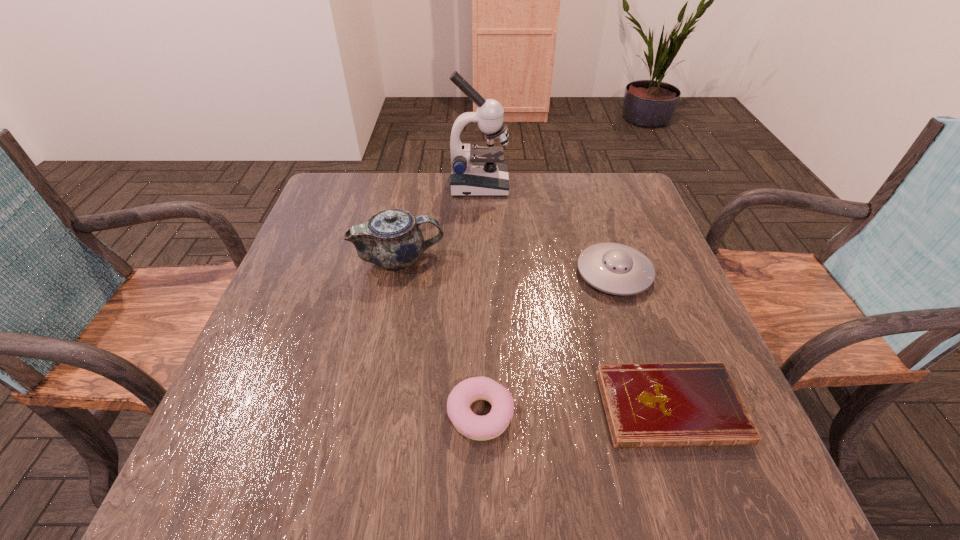
Image resolution: width=960 pixels, height=540 pixels. What are the coordinates of `free spot between the third tallest object and the chinaware` in the screenshot? It's located at (507, 266).

I want to click on free space between the third shortest object and the doughnut, so click(547, 344).

You are a GUI agent. You are given a task and a screenshot of the screen. Output one action in this format:
    pyautogui.click(x=<x>, y=<y>)
    Task: Click on the vacant area that lies between the chinaware and the third shortest object
    
    Given the screenshot: What is the action you would take?
    pyautogui.click(x=507, y=266)

Identify which object is located as the third nearest to the second tallest object. Please provide its 2D coordinates. Your answer should be formatted as a tuple, i.e. [(x, y)], where the tuple contains the x and y coordinates of a point satisfying the conditions above.

[(614, 268)]

Select which object appears as the third closest to the fourth tallest object. Please provide its 2D coordinates. Your answer should be formatted as a tuple, i.e. [(x, y)], where the tuple contains the x and y coordinates of a point satisfying the conditions above.

[(391, 239)]

The image size is (960, 540). I want to click on free space that satisfies the following two spatial constraints: 1. at the eyepiece of the notebook; 2. on the left side of the tallest object, so click(478, 407).

Image resolution: width=960 pixels, height=540 pixels. I want to click on free space that satisfies the following two spatial constraints: 1. from the spout of the notebook; 2. on the left side of the second tallest object, so pos(371,407).

Identify the location of vacant region that satisfies the following two spatial constraints: 1. at the eyepiece of the microscope; 2. on the right side of the fourth tallest object. The width and height of the screenshot is (960, 540). (478, 414).

At what (x,y) coordinates should I click in order to perform the action: click on vacant position in the image that satisfies the following two spatial constraints: 1. on the back side of the saucer; 2. from the spout of the chinaware. Please return your answer as a coordinate pair (x, y). Image resolution: width=960 pixels, height=540 pixels. Looking at the image, I should click on (610, 259).

Find the location of a particular element. The height and width of the screenshot is (540, 960). vacant space that satisfies the following two spatial constraints: 1. at the eyepiece of the microscope; 2. on the back side of the fourth tallest object is located at coordinates (478, 414).